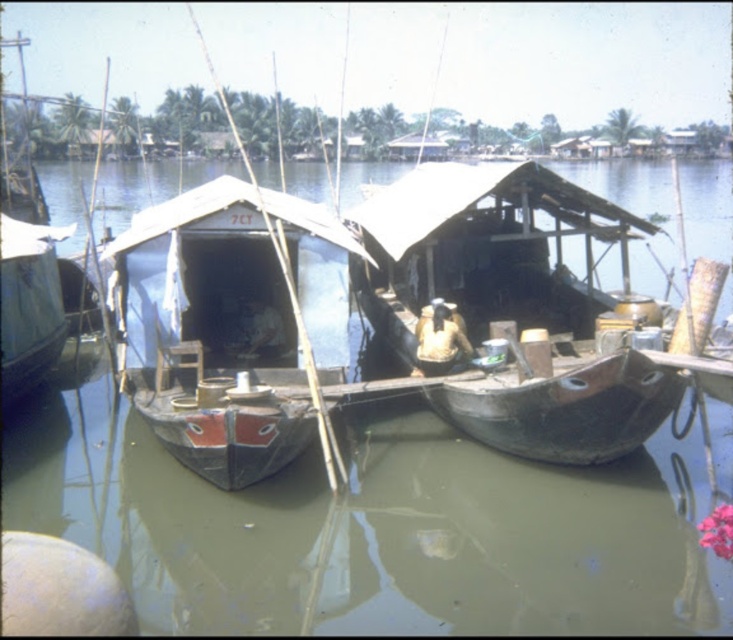
Does dark brown wooden boat at center appear under wooden boat at left?

No.

Does dark brown wooden boat at center have a lesser width compared to wooden boat at left?

In fact, dark brown wooden boat at center might be wider than wooden boat at left.

In order to click on dark brown wooden boat at center in this screenshot , I will do click(x=515, y=305).

Locate an element on the screen. The width and height of the screenshot is (733, 640). dark brown wooden boat at center is located at coordinates (515, 305).

Between wooden boat at center and wooden boat at left, which one is positioned higher?

wooden boat at left

Which of these two, wooden boat at center or wooden boat at left, stands shorter?

wooden boat at left is shorter.

Where is `wooden boat at center`? This screenshot has width=733, height=640. wooden boat at center is located at coordinates (210, 333).

You are a GUI agent. You are given a task and a screenshot of the screen. Output one action in this format:
    pyautogui.click(x=<x>, y=<y>)
    Task: Click on the wooden boat at center
    
    Given the screenshot: What is the action you would take?
    pyautogui.click(x=210, y=333)

Is point (589, 205) farther from camera compared to point (292, 317)?

No.

Locate an element on the screen. Image resolution: width=733 pixels, height=640 pixels. dark brown wooden boat at center is located at coordinates (515, 305).

Which is in front, point (372, 291) or point (246, 433)?

Point (246, 433) is more forward.

This screenshot has height=640, width=733. Identify the location of dark brown wooden boat at center. click(x=515, y=305).